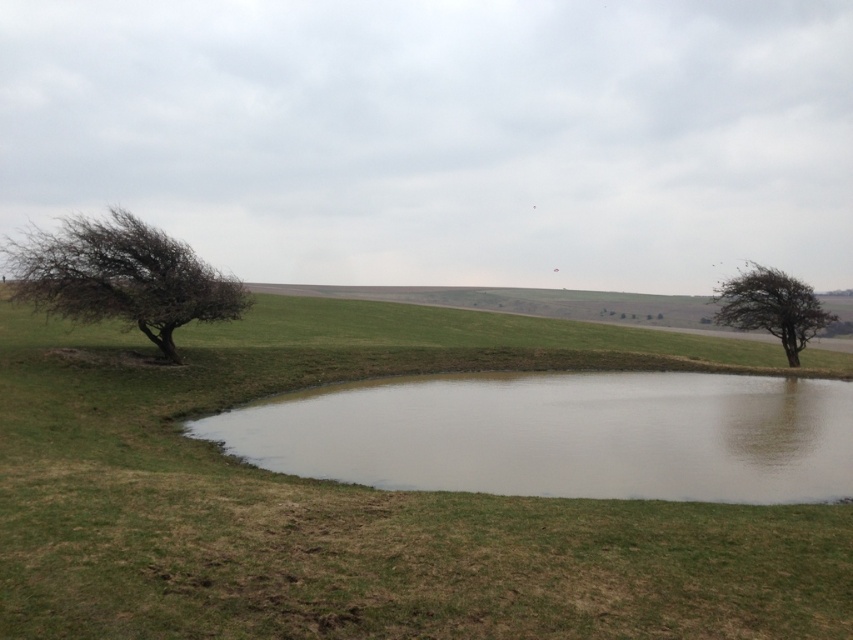
Looking at this image, you are a gardener planning to mow the green grassy at center and trim the green leafy tree at right. Based on their heights, which task should you tackle first if you want to start with the shorter one?

The green grassy at center is not as tall as the green leafy tree at right, so you should mow the green grassy at center first since it is shorter.

In the scene shown: You are standing at the edge of the pond and want to walk to the green leafy tree at right. Which direction should you head to avoid the green grassy at center?

The green grassy at center is to the left of the green leafy tree at right, so you should head to the right to avoid it.